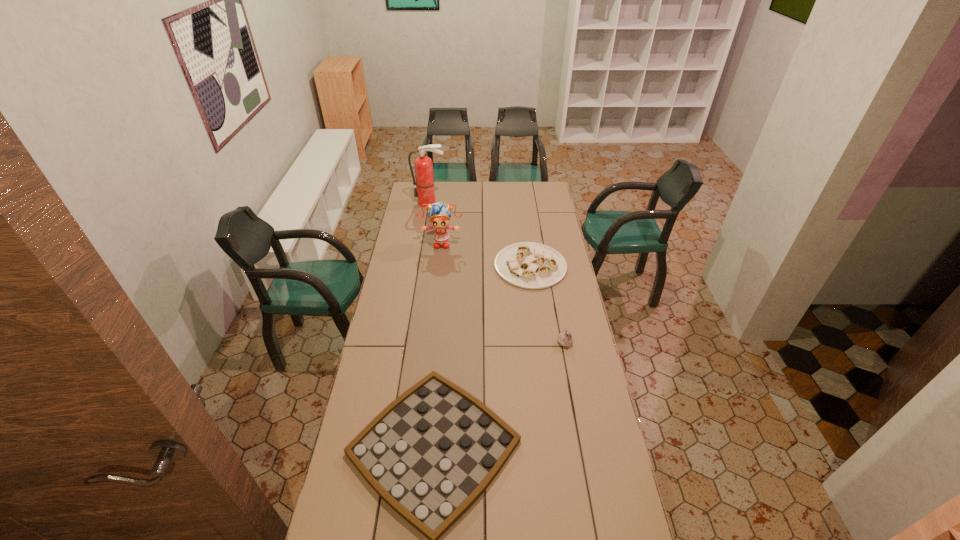
The image size is (960, 540). What are the coordinates of `unoccupied area between the second nearest object and the second shortest object` in the screenshot? It's located at (547, 304).

Locate an element on the screen. Image resolution: width=960 pixels, height=540 pixels. vacant point located between the farthest object and the garlic is located at coordinates 497,272.

Find the location of a particular element. The height and width of the screenshot is (540, 960). object that is the second nearest to the doll is located at coordinates (423, 165).

The image size is (960, 540). In order to click on object that ranks as the third closest to the garlic in this screenshot , I will do `click(439, 214)`.

The height and width of the screenshot is (540, 960). I want to click on free spot that satisfies the following two spatial constraints: 1. on the face of the platter; 2. on the left side of the fourth shortest object, so click(439, 266).

Locate an element on the screen. The height and width of the screenshot is (540, 960). vacant area in the image that satisfies the following two spatial constraints: 1. on the face of the fourth tallest object; 2. on the right side of the fourth shortest object is located at coordinates (439, 266).

Where is `free space that satisfies the following two spatial constraints: 1. on the face of the garlic; 2. on the right side of the doll`? Image resolution: width=960 pixels, height=540 pixels. free space that satisfies the following two spatial constraints: 1. on the face of the garlic; 2. on the right side of the doll is located at coordinates (430, 342).

Find the location of a particular element. This screenshot has width=960, height=540. free region that satisfies the following two spatial constraints: 1. with the handle and hose on the farthest object; 2. on the left side of the third shortest object is located at coordinates (407, 342).

Where is `free region that satisfies the following two spatial constraints: 1. on the face of the doll; 2. on the left side of the garlic`? free region that satisfies the following two spatial constraints: 1. on the face of the doll; 2. on the left side of the garlic is located at coordinates (430, 342).

Image resolution: width=960 pixels, height=540 pixels. What are the coordinates of `vacant space that satisfies the following two spatial constraints: 1. on the face of the second tallest object; 2. on the right side of the platter` in the screenshot? It's located at (439, 266).